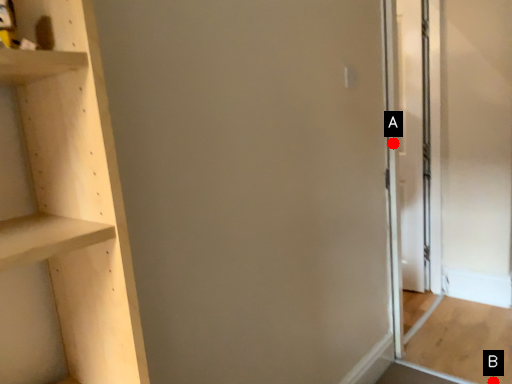
Question: Two points are circled on the image, labeled by A and B beside each circle. Which point appears farthest from the camera in this image?

Choices:
 (A) A is further
 (B) B is further

Answer: (A)